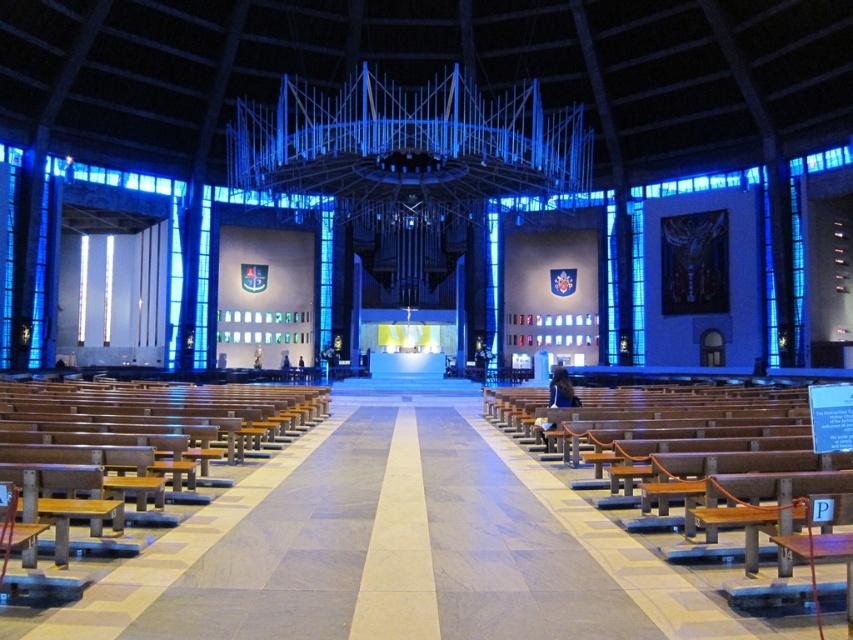
Is wooden polished bench at center wider than brown wooden bench at left?

No.

Who is more distant from viewer, (828, 536) or (45, 432)?

The point (45, 432) is behind.

Between point (827, 598) and point (201, 502), which one is positioned in front?

Positioned in front is point (827, 598).

This screenshot has height=640, width=853. Identify the location of wooden polished bench at center. (708, 472).